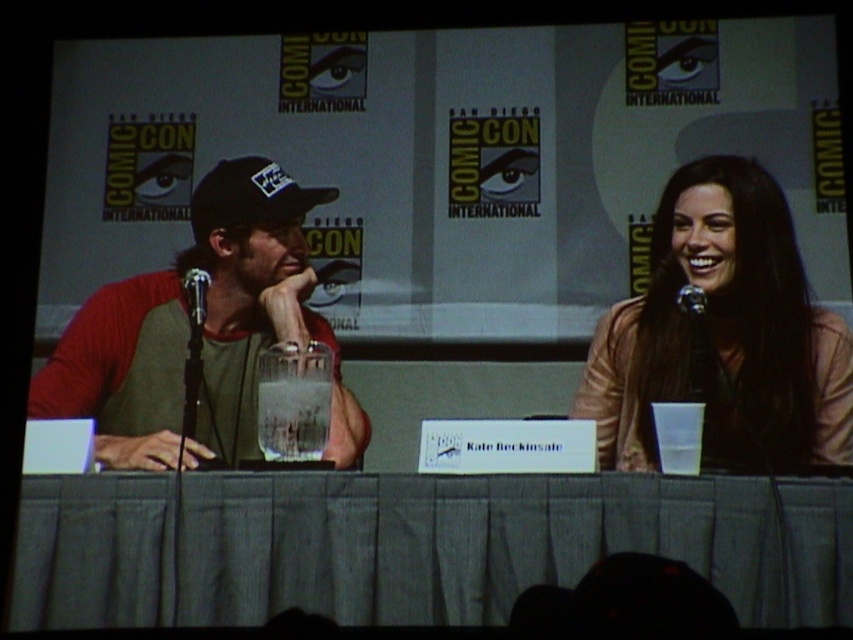
In the scene shown: What is the 2D coordinate of the gray fabric table at center in the image?

The gray fabric table at center is located at the 2D coordinate point of (497, 541).

You are a photographer at Comic Con and want to take a photo of the panel discussion. You notice the matte pink sweater at right and the metallic silver microphone at center. Which object is positioned lower in the image?

The matte pink sweater at right is positioned lower than the metallic silver microphone at center.

You are a photographer at the event and want to capture a shot of the metallic silver microphone at center and the matte pink sweater at right. From the perspective of someone facing the stage, which object is positioned to the left?

The metallic silver microphone at center is to the left of the matte pink sweater at right, so the microphone is positioned to the left when facing the stage.